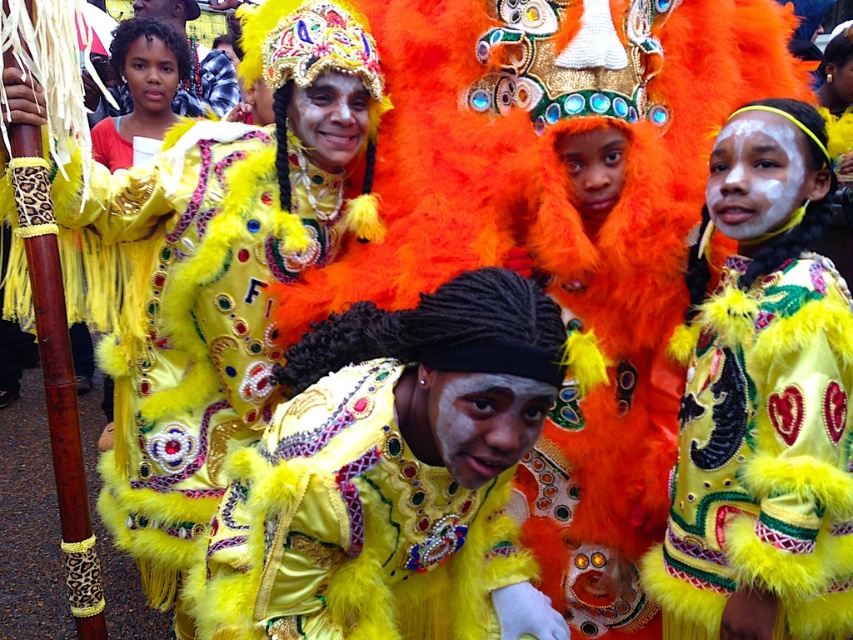
Does yellow fuzzy jacket at center have a lesser height compared to shiny yellow feathered costume at upper left?

No, yellow fuzzy jacket at center is not shorter than shiny yellow feathered costume at upper left.

Between point (793, 257) and point (115, 116), which one is positioned in front?

Point (793, 257) is in front.

You are a GUI agent. You are given a task and a screenshot of the screen. Output one action in this format:
    pyautogui.click(x=<x>, y=<y>)
    Task: Click on the yellow fuzzy jacket at center
    
    Given the screenshot: What is the action you would take?
    pyautogui.click(x=762, y=456)

You are a GUI agent. You are given a task and a screenshot of the screen. Output one action in this format:
    pyautogui.click(x=<x>, y=<y>)
    Task: Click on the yellow fuzzy jacket at center
    The width and height of the screenshot is (853, 640).
    Given the screenshot: What is the action you would take?
    pyautogui.click(x=762, y=456)

Measure the distance between shiny yellow fur coat at center and yellow fuzzy jacket at center.

1.38 meters

What do you see at coordinates (199, 317) in the screenshot? I see `shiny yellow fur coat at center` at bounding box center [199, 317].

Which is in front, point (212, 332) or point (801, 573)?

Point (801, 573) is more forward.

This screenshot has width=853, height=640. What are the coordinates of `shiny yellow fur coat at center` in the screenshot? It's located at (199, 317).

Does shiny yellow fur coat at center have a lesser height compared to shiny yellow feathered costume at upper left?

Incorrect, shiny yellow fur coat at center's height does not fall short of shiny yellow feathered costume at upper left's.

Does point (154, 509) come behind point (105, 132)?

No.

Find the location of `shiny yellow fur coat at center`. shiny yellow fur coat at center is located at coordinates (199, 317).